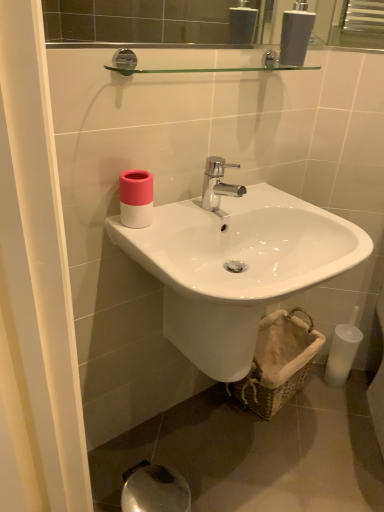
Question: From the image's perspective, is brown woven basket at lower right located above or below white glossy soap dispenser at upper center?

Choices:
 (A) above
 (B) below

Answer: (B)

Question: Relative to white glossy soap dispenser at upper center, is brown woven basket at lower right in front or behind?

Choices:
 (A) behind
 (B) front

Answer: (A)

Question: Estimate the real-world distances between objects in this image. Which object is closer to the white glossy sink at center?

Choices:
 (A) white glossy soap dispenser at upper center
 (B) pink matte cup at upper left
 (C) brown woven basket at lower right

Answer: (B)

Question: Which object is positioned farthest from the pink matte cup at upper left?

Choices:
 (A) white glossy sink at center
 (B) brown woven basket at lower right
 (C) white glossy soap dispenser at upper center

Answer: (B)